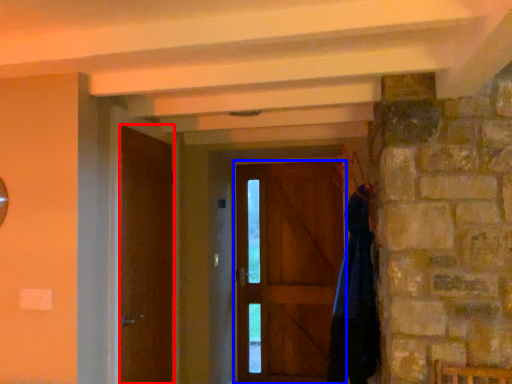
Question: Which object appears farthest to the camera in this image, door (highlighted by a red box) or door (highlighted by a blue box)?

Choices:
 (A) door
 (B) door

Answer: (B)